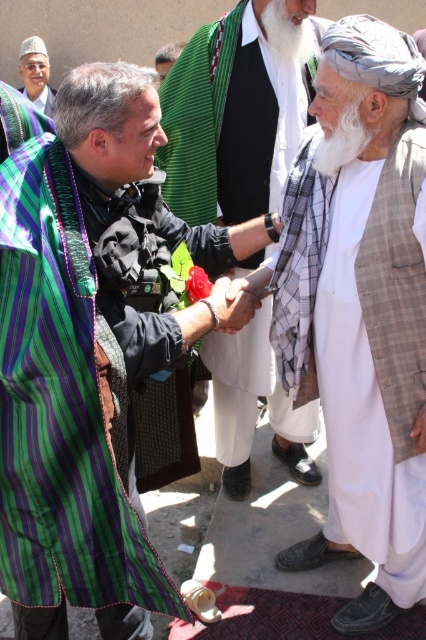
Question: Which point appears farthest from the camera in this image?

Choices:
 (A) (169, 60)
 (B) (423, 147)

Answer: (A)

Question: Does green striped robe at center appear on the left side of green striped robe at upper left?

Choices:
 (A) no
 (B) yes

Answer: (A)

Question: Is green striped robe at upper left positioned at the back of plaid fabric hand at center?

Choices:
 (A) no
 (B) yes

Answer: (B)

Question: Which of these objects is positioned closest to the white cotton robe at right?

Choices:
 (A) plaid fabric hand at center
 (B) green striped robe at upper left
 (C) whitehairbeard at upper center
 (D) green striped cloth at center

Answer: (A)

Question: Is white textured robe at center positioned in front of matte black hand at center?

Choices:
 (A) yes
 (B) no

Answer: (B)

Question: Which of the following is the farthest from the observer?

Choices:
 (A) green striped cloth at center
 (B) whitehairbeard at upper center
 (C) green striped robe at upper left

Answer: (C)